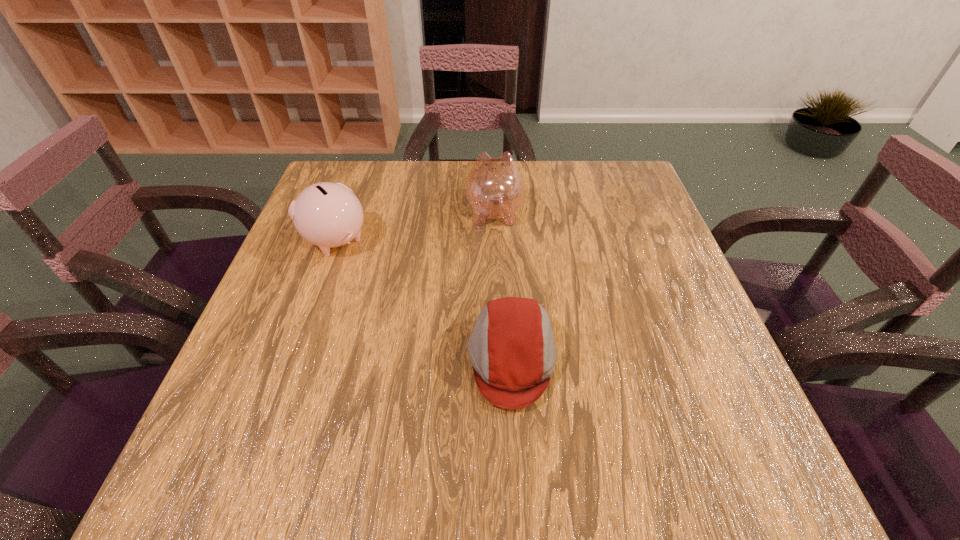
At what (x,y) coordinates should I click in order to perform the action: click on object that is at the far edge. Please return your answer as a coordinate pair (x, y). This screenshot has width=960, height=540. Looking at the image, I should click on (494, 188).

Find the location of a particular element. The width and height of the screenshot is (960, 540). object that is positioned at the left edge is located at coordinates (328, 215).

In the image, there is a desktop. Identify the location of free space at the far edge. (471, 169).

The image size is (960, 540). What are the coordinates of `vacant region at the near edge of the desktop` in the screenshot? It's located at (514, 472).

In the image, there is a desktop. Identify the location of vacant region at the left edge. (269, 318).

This screenshot has width=960, height=540. I want to click on blank area at the right edge, so click(x=647, y=220).

In the image, there is a desktop. In order to click on blank space at the far left corner in this screenshot , I will do `click(347, 182)`.

Where is `free space at the near right corner of the desktop`? The width and height of the screenshot is (960, 540). free space at the near right corner of the desktop is located at coordinates (723, 442).

Find the location of `vacant region between the right piggy bank and the nearest object`. vacant region between the right piggy bank and the nearest object is located at coordinates (503, 286).

You are a GUI agent. You are given a task and a screenshot of the screen. Output one action in this format:
    pyautogui.click(x=<x>, y=<y>)
    Task: Click on the free spot between the right piggy bank and the left piggy bank
    This screenshot has width=960, height=540.
    Given the screenshot: What is the action you would take?
    pyautogui.click(x=415, y=226)